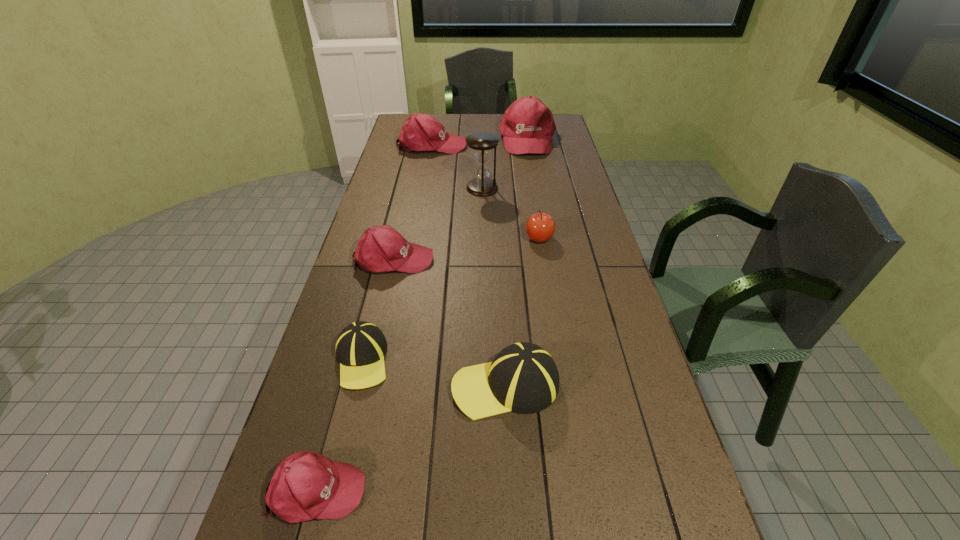
You are a GUI agent. You are given a task and a screenshot of the screen. Output one action in this format:
    pyautogui.click(x=<x>, y=<y>)
    Task: Click on the hourglass
    
    Given the screenshot: What is the action you would take?
    pyautogui.click(x=482, y=143)

This screenshot has width=960, height=540. I want to click on the seventh shortest object, so click(527, 126).

You are a GUI agent. You are given a task and a screenshot of the screen. Output one action in this format:
    pyautogui.click(x=<x>, y=<y>)
    Task: Click on the rightmost red baseball cap
    
    Given the screenshot: What is the action you would take?
    pyautogui.click(x=527, y=126)

The image size is (960, 540). Identify the location of the third smallest red baseball cap. (421, 132).

Where is `the second tallest baseball cap`? the second tallest baseball cap is located at coordinates tap(421, 132).

You are a GUI agent. You are given a task and a screenshot of the screen. Output one action in this format:
    pyautogui.click(x=<x>, y=<y>)
    Task: Click on the third farthest red baseball cap
    This screenshot has height=540, width=960.
    Given the screenshot: What is the action you would take?
    pyautogui.click(x=381, y=248)

Where is `the third farthest baseball cap`? This screenshot has height=540, width=960. the third farthest baseball cap is located at coordinates (381, 248).

This screenshot has width=960, height=540. In order to click on apple in this screenshot , I will do `click(540, 227)`.

Image resolution: width=960 pixels, height=540 pixels. I want to click on the right black baseball cap, so click(523, 378).

Identify the location of the nearest object. The height and width of the screenshot is (540, 960). (306, 485).